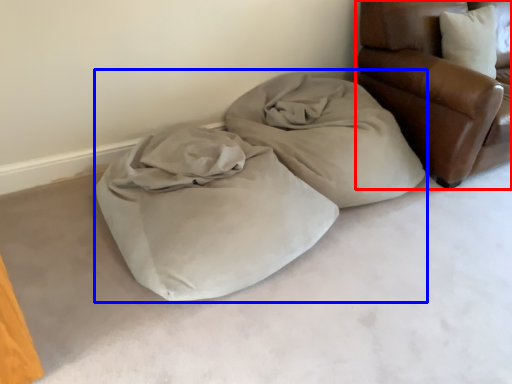
Question: Among these objects, which one is nearest to the camera, furniture (highlighted by a red box) or bed (highlighted by a blue box)?

Choices:
 (A) furniture
 (B) bed

Answer: (B)